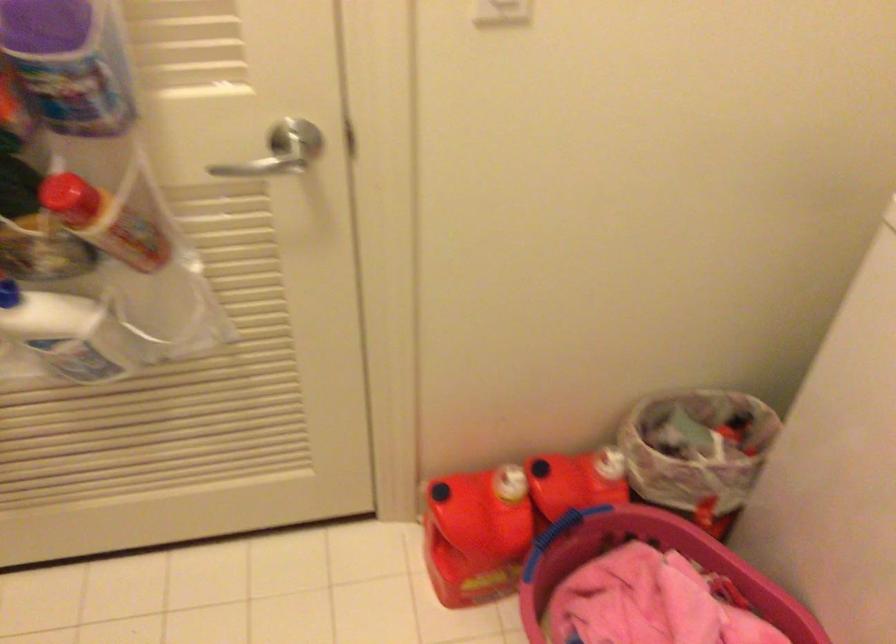
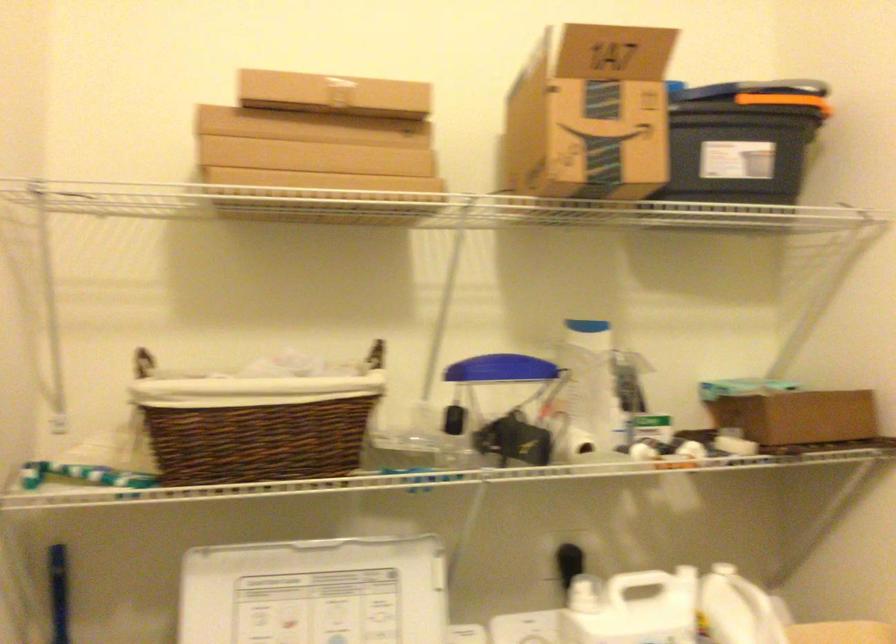
Question: The camera is either moving clockwise (left) or counter-clockwise (right) around the object. The first image is from the beginning of the video and the second image is from the end. Is the camera moving left or right when shooting the video?

Choices:
 (A) Left
 (B) Right

Answer: (A)